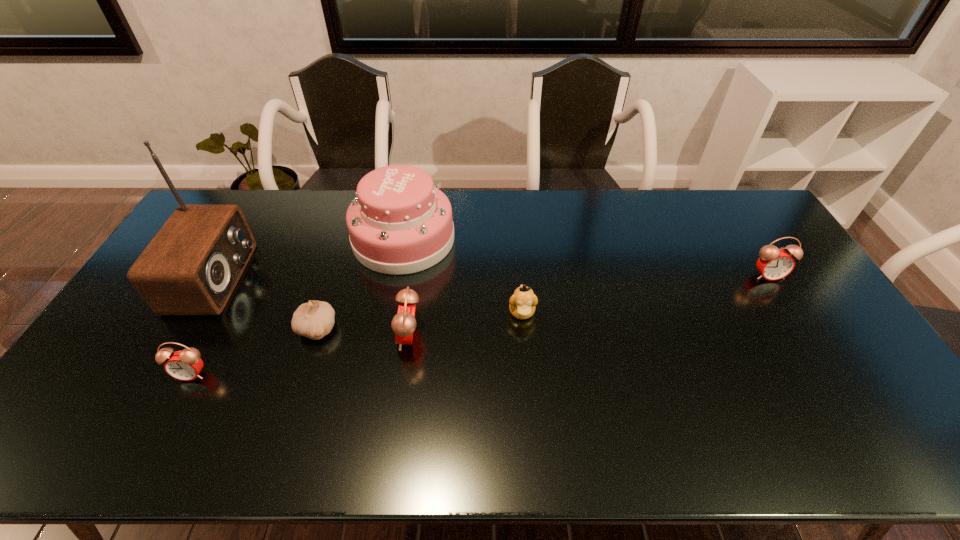
Where is `blank space that satisfies the following two spatial constraints: 1. on the face of the sixth object from left to right; 2. on the clock face of the second farthest alarm clock`? This screenshot has height=540, width=960. blank space that satisfies the following two spatial constraints: 1. on the face of the sixth object from left to right; 2. on the clock face of the second farthest alarm clock is located at coordinates (524, 336).

Identify the location of vacant space that satisfies the following two spatial constraints: 1. on the front-facing side of the garlic; 2. on the left side of the radio receiver. (185, 329).